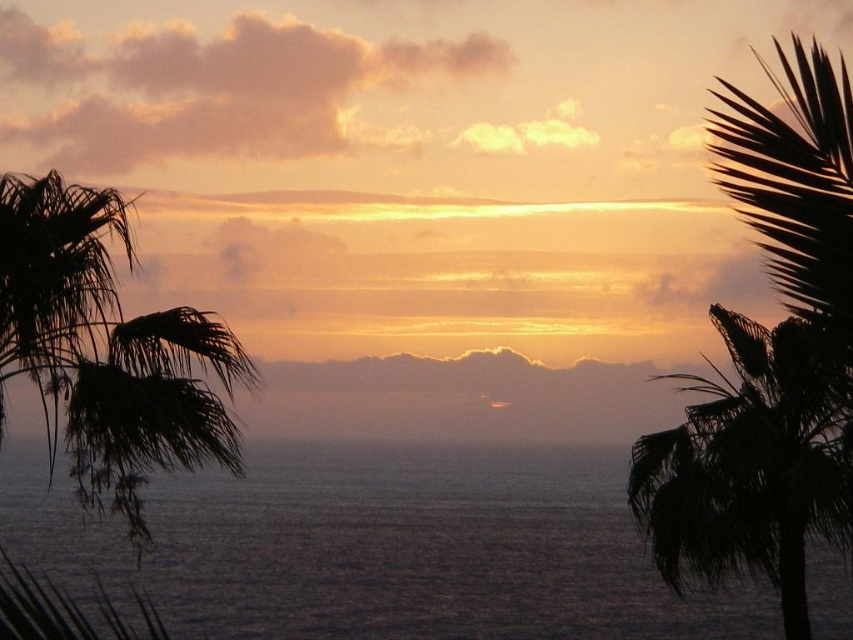
Question: Can you confirm if dark gray water at center is positioned below silhouette leafy palm at right?

Choices:
 (A) yes
 (B) no

Answer: (A)

Question: Can you confirm if silhouette leafy palm at left is positioned to the right of silhouette leafy palm at right?

Choices:
 (A) yes
 (B) no

Answer: (B)

Question: Which object appears farthest from the camera in this image?

Choices:
 (A) silhouette leafy palm at right
 (B) silhouette leafy palm at left

Answer: (A)

Question: Among these points, which one is farthest from the camera?

Choices:
 (A) (136, 468)
 (B) (688, 385)

Answer: (B)

Question: Is dark gray water at center positioned before silhouette leafy palm at left?

Choices:
 (A) yes
 (B) no

Answer: (B)

Question: Which of these objects is positioned farthest from the dark gray water at center?

Choices:
 (A) silhouette leafy palm at left
 (B) silhouette leafy palm at right

Answer: (B)